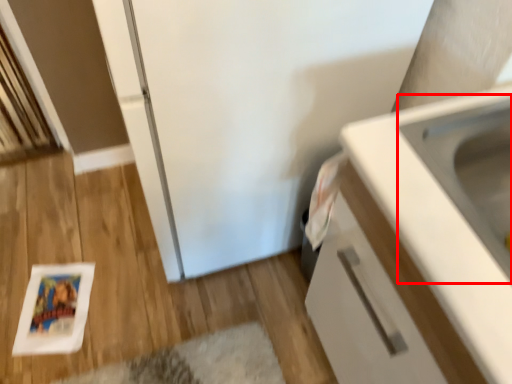
Question: From the image's perspective, considering the relative positions of sink (annotated by the red box) and cabinetry in the image provided, where is sink (annotated by the red box) located with respect to the staircase?

Choices:
 (A) below
 (B) above

Answer: (B)